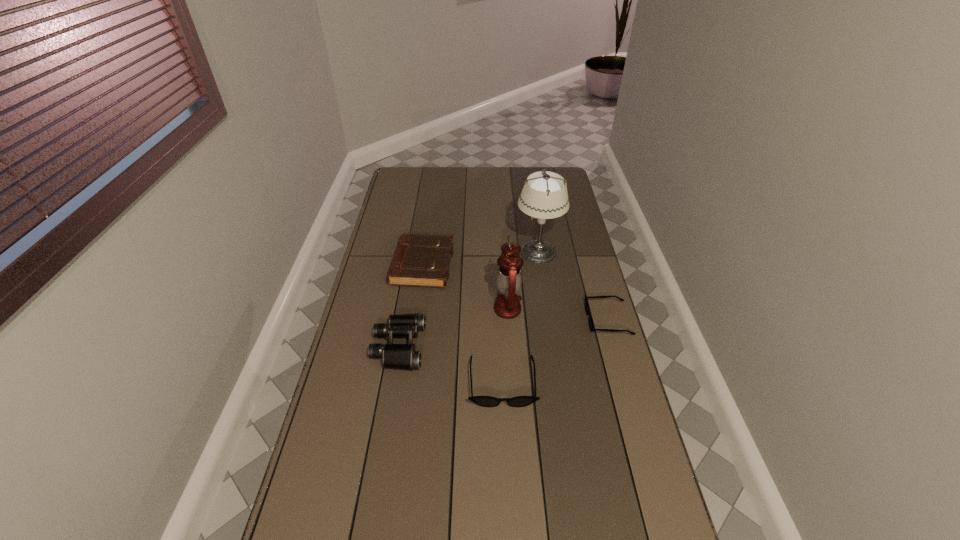
This screenshot has width=960, height=540. I want to click on the left sunglasses, so click(485, 401).

I want to click on the second shortest object, so click(485, 401).

In order to click on the farther sunglasses in this screenshot , I will do `click(591, 325)`.

Image resolution: width=960 pixels, height=540 pixels. In order to click on the rightmost object in this screenshot , I will do `click(591, 325)`.

The height and width of the screenshot is (540, 960). In order to click on the third shortest object in this screenshot , I will do (x=419, y=260).

The height and width of the screenshot is (540, 960). I want to click on lampshade, so click(x=544, y=196).

In order to click on oil lamp in this screenshot , I will do `click(509, 278)`.

This screenshot has height=540, width=960. Identify the location of the third tallest object. (394, 356).

Identify the location of vacant position located on the front-facing side of the nearer sunglasses. The image size is (960, 540). click(x=508, y=515).

In order to click on vacant region located 0.130m on the front-facing side of the rightmost object in this screenshot , I will do `click(551, 320)`.